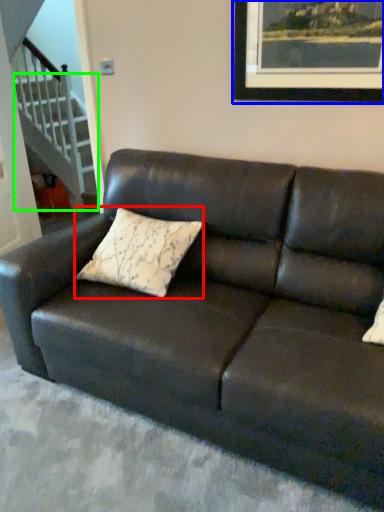
Question: Which object is the farthest from pillow (highlighted by a red box)? Choose among these: picture frame (highlighted by a blue box) or stairwell (highlighted by a green box).

Choices:
 (A) picture frame
 (B) stairwell

Answer: (B)